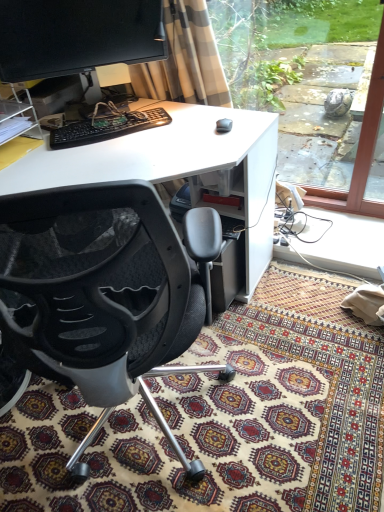
You are a GUI agent. You are given a task and a screenshot of the screen. Output one action in this format:
    pyautogui.click(x=<x>, y=<y>)
    Task: Click on the vacant region to the right of black mesh chair at center
    
    Given the screenshot: What is the action you would take?
    pyautogui.click(x=292, y=394)